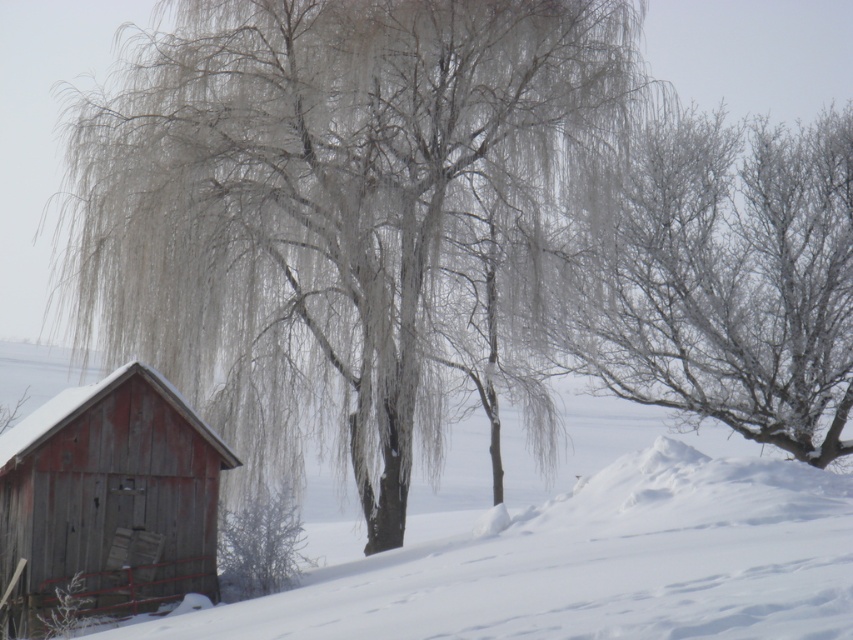
Question: Based on their relative distances, which object is farther from the frosted wood tree at left?

Choices:
 (A) frosted branches at center
 (B) white fluffy snow at lower left

Answer: (A)

Question: Observing the image, what is the correct spatial positioning of white fluffy snow at lower left in reference to rusty wood cabin at lower left?

Choices:
 (A) above
 (B) below

Answer: (B)

Question: Among these points, which one is nearest to the camera?

Choices:
 (A) (447, 244)
 (B) (152, 556)
 (C) (538, 577)
 (D) (693, 179)

Answer: (C)

Question: Considering the relative positions of frosted wood tree at left and white fluffy snow at lower left in the image provided, where is frosted wood tree at left located with respect to white fluffy snow at lower left?

Choices:
 (A) above
 (B) below

Answer: (A)

Question: Among these objects, which one is nearest to the camera?

Choices:
 (A) frosted wood tree at left
 (B) white fluffy snow at lower left
 (C) frosted branches at center
 (D) rusty wood cabin at lower left

Answer: (B)

Question: Does frosted wood tree at left have a lesser width compared to rusty wood cabin at lower left?

Choices:
 (A) yes
 (B) no

Answer: (B)